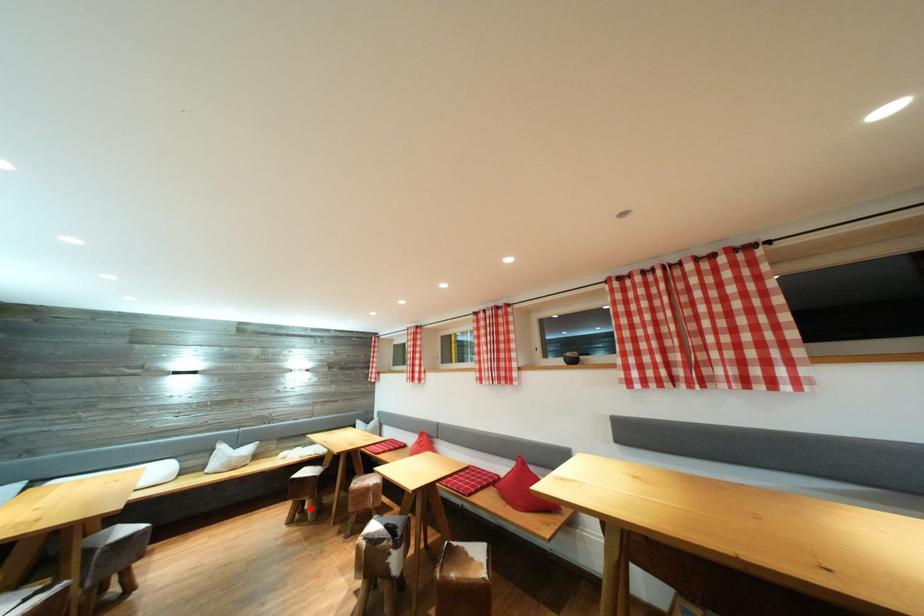
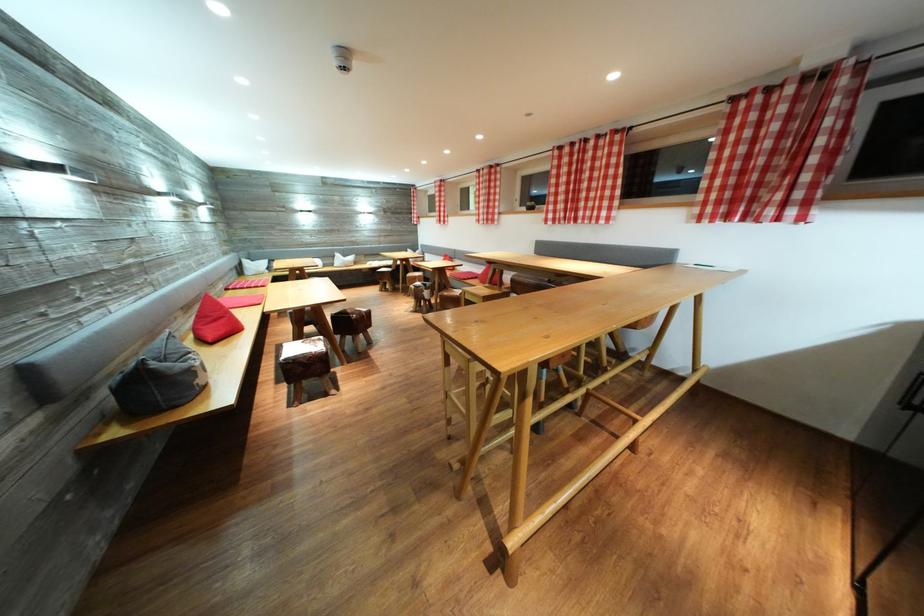
Question: I am providing you with two images of the same scene from different viewpoints. A red point is marked on the first image. At the location where the point appears in image 1, is it still visible in image 2?

Choices:
 (A) Yes
 (B) No

Answer: (A)